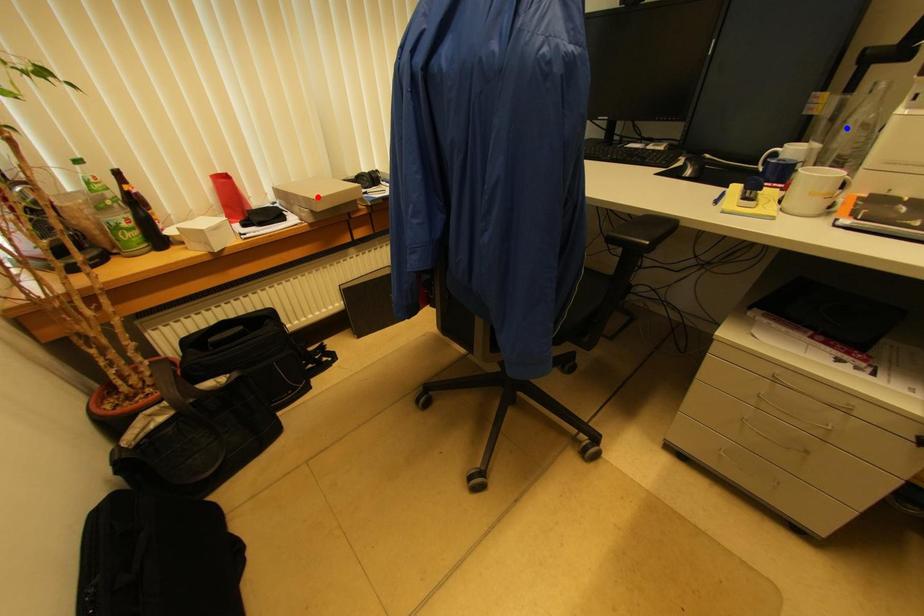
Question: Two points are marked on the image. Which point is closer to the camera?

Choices:
 (A) Blue point is closer.
 (B) Red point is closer.

Answer: (A)